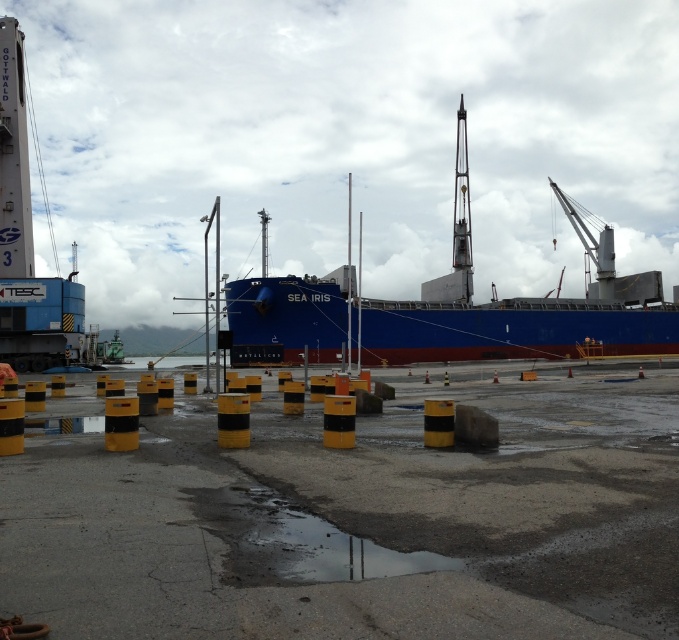
Question: Which of the following is the farthest from the observer?

Choices:
 (A) yellow/black striped barrels at center
 (B) blue matte ship at center

Answer: (B)

Question: Is yellow/black striped barrels at center to the left of blue matte ship at center from the viewer's perspective?

Choices:
 (A) yes
 (B) no

Answer: (A)

Question: Among these points, which one is nearest to the camera?

Choices:
 (A) (327, 308)
 (B) (458, 465)

Answer: (B)

Question: Does yellow/black striped barrels at center appear on the right side of blue matte ship at center?

Choices:
 (A) yes
 (B) no

Answer: (B)

Question: Observing the image, what is the correct spatial positioning of yellow/black striped barrels at center in reference to blue matte ship at center?

Choices:
 (A) right
 (B) left

Answer: (B)